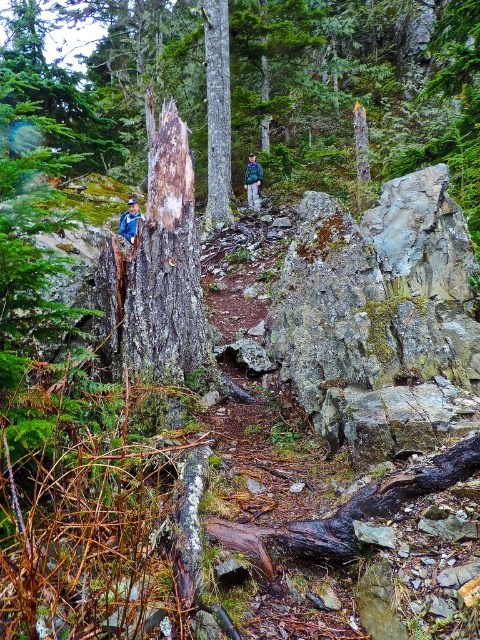
Question: Based on their relative distances, which object is farther from the gray mossy rock at upper center?

Choices:
 (A) blue denim jacket at left
 (B) green fabric jacket at center
 (C) smooth gray tree trunk at center

Answer: (B)

Question: In this image, where is gray mossy rock at upper center located relative to green fabric jacket at center?

Choices:
 (A) below
 (B) above

Answer: (A)

Question: Is gray mossy rock at upper center bigger than blue denim jacket at left?

Choices:
 (A) yes
 (B) no

Answer: (A)

Question: Is green fabric jacket at center above blue denim jacket at left?

Choices:
 (A) yes
 (B) no

Answer: (A)

Question: Among these objects, which one is nearest to the camera?

Choices:
 (A) smooth gray tree trunk at center
 (B) blue denim jacket at left

Answer: (B)

Question: Which point is closer to the camera?

Choices:
 (A) smooth gray tree trunk at center
 (B) blue denim jacket at left
 (C) green fabric jacket at center
 (D) gray mossy rock at upper center

Answer: (D)